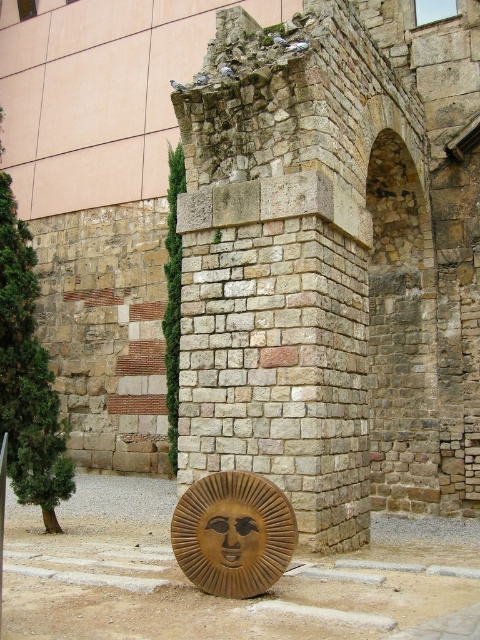
You are standing at the point marked as point (232, 532) in the image. What object is directly in front of you?

The golden polished sun at lower center is directly in front of you at point (232, 532).

You are an architect designing a new garden layout. You need to place the golden polished sun at lower center and the wooden carved face at lower center in such a way that they are both visible from the main pathway. Given their sizes, which object should be placed closer to the pathway to ensure both are easily seen?

The golden polished sun at lower center is smaller than the wooden carved face at lower center. To ensure both are easily seen from the pathway, the golden polished sun at lower center should be placed closer to the pathway since it is smaller and needs to be more accessible for visibility.

You are an architect visiting this site and need to install a new light fixture between the golden polished sun at lower center and the wooden carved face at lower center. Based on their heights, which object should the light fixture be positioned closer to?

The golden polished sun at lower center has a lesser height compared to the wooden carved face at lower center, so the light fixture should be positioned closer to the wooden carved face at lower center to ensure proper illumination based on their relative heights.